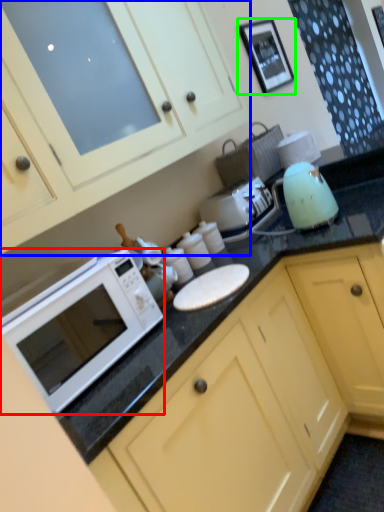
Question: Which object is the farthest from microwave oven (highlighted by a red box)? Choose among these: cabinetry (highlighted by a blue box) or picture frame (highlighted by a green box).

Choices:
 (A) cabinetry
 (B) picture frame

Answer: (B)